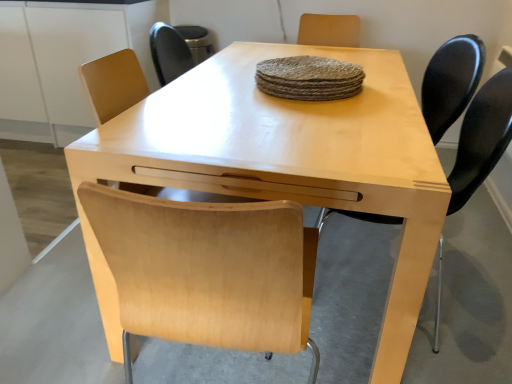
Find the location of a particular element. unoccupied region to the right of matte black chair at right, positioned as the 2th chair in back-to-front order is located at coordinates (478, 295).